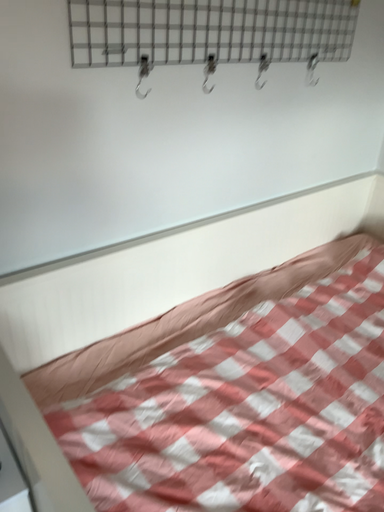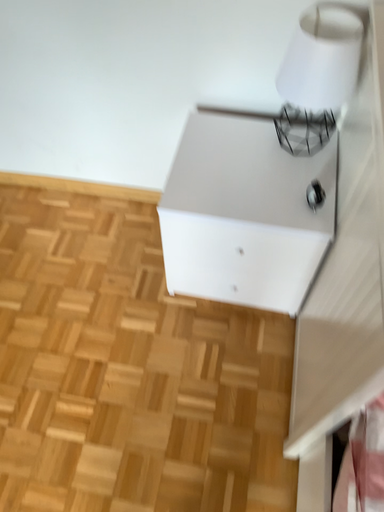
Question: How did the camera likely rotate when shooting the video?

Choices:
 (A) rotated left
 (B) rotated right

Answer: (A)